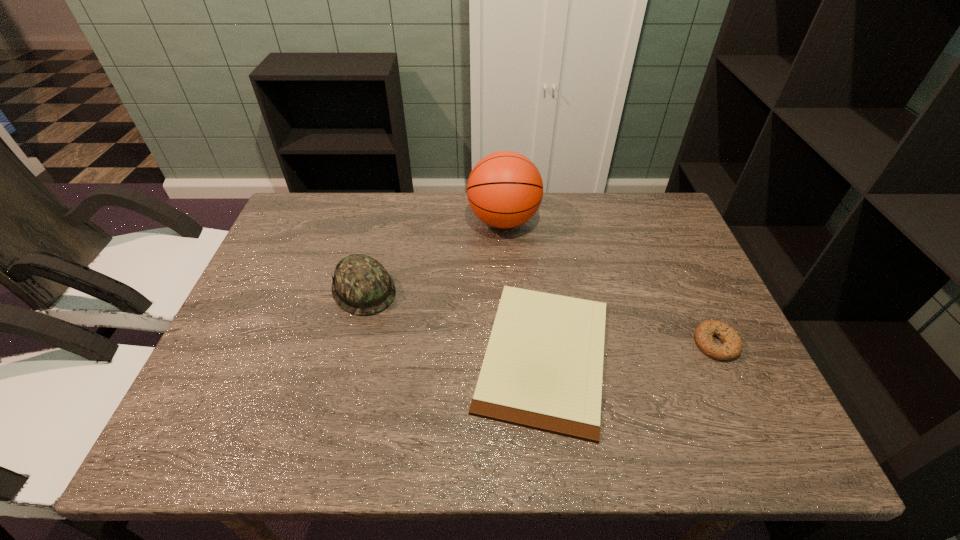
This screenshot has width=960, height=540. Identify the location of vacant space that satisfies the following two spatial constraints: 1. on the front side of the bagel; 2. on the left side of the basketball. (511, 343).

Locate an element on the screen. This screenshot has width=960, height=540. vacant space that satisfies the following two spatial constraints: 1. on the front side of the leftmost object; 2. on the left side of the second shortest object is located at coordinates (350, 343).

Where is `free spot that satisfies the following two spatial constraints: 1. on the back side of the bagel; 2. on the right side of the shortest object`? This screenshot has height=540, width=960. free spot that satisfies the following two spatial constraints: 1. on the back side of the bagel; 2. on the right side of the shortest object is located at coordinates (543, 343).

At what (x,y) coordinates should I click in order to perform the action: click on blank space that satisfies the following two spatial constraints: 1. on the front side of the third shortest object; 2. on the left side of the third tallest object. Please return your answer as a coordinate pair (x, y). The image size is (960, 540). Looking at the image, I should click on (350, 343).